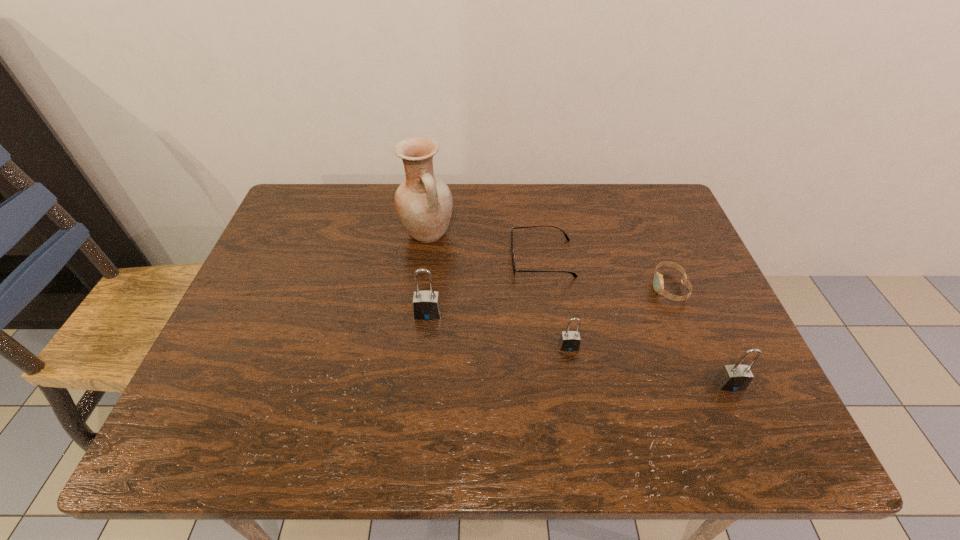
Find the location of a particular element. The height and width of the screenshot is (540, 960). the farthest padlock is located at coordinates (426, 304).

Locate an element on the screen. The width and height of the screenshot is (960, 540). the leftmost padlock is located at coordinates (426, 304).

Image resolution: width=960 pixels, height=540 pixels. I want to click on the fourth tallest object, so click(569, 341).

You are a GUI agent. You are given a task and a screenshot of the screen. Output one action in this format:
    pyautogui.click(x=<x>, y=<y>)
    Task: Click on the shortest padlock
    
    Given the screenshot: What is the action you would take?
    pyautogui.click(x=569, y=341)

Find the location of a particular element. The width and height of the screenshot is (960, 540). the third tallest object is located at coordinates click(x=737, y=377).

In order to click on the nearest object in this screenshot , I will do `click(737, 377)`.

At what (x,y) coordinates should I click in order to perform the action: click on the tallest object. Please return your answer as a coordinate pair (x, y). Image resolution: width=960 pixels, height=540 pixels. Looking at the image, I should click on (424, 203).

This screenshot has height=540, width=960. I want to click on watch, so click(x=658, y=283).

Identify the location of the shortest object. (566, 236).

Find the location of a particular element. free space located on the shackle of the fourth farthest object is located at coordinates (424, 341).